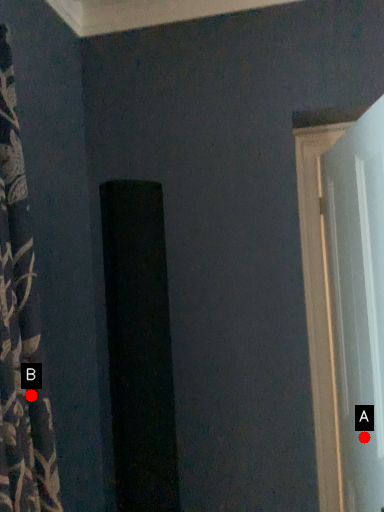
Question: Two points are circled on the image, labeled by A and B beside each circle. Which of the following is the farthest from the observer?

Choices:
 (A) A is further
 (B) B is further

Answer: (A)